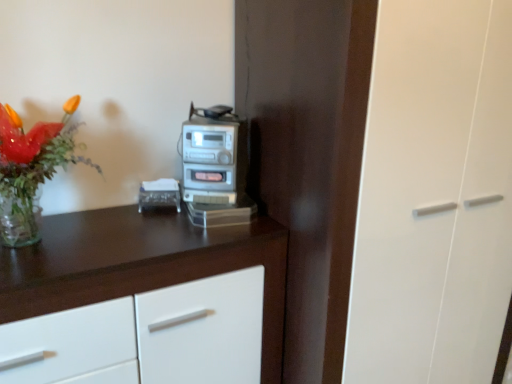
Question: Is white glossy cabinet at upper left surrounding silver metallic stereo at center?

Choices:
 (A) no
 (B) yes

Answer: (A)

Question: From a real-world perspective, does white glossy cabinet at upper left stand above silver metallic stereo at center?

Choices:
 (A) no
 (B) yes

Answer: (A)

Question: Does white glossy cabinet at upper left have a greater width compared to silver metallic stereo at center?

Choices:
 (A) no
 (B) yes

Answer: (B)

Question: Are white glossy cabinet at upper left and silver metallic stereo at center beside each other?

Choices:
 (A) yes
 (B) no

Answer: (B)

Question: Is the position of white glossy cabinet at upper left less distant than that of silver metallic stereo at center?

Choices:
 (A) yes
 (B) no

Answer: (A)

Question: Can you confirm if white glossy cabinet at upper left is smaller than silver metallic stereo at center?

Choices:
 (A) no
 (B) yes

Answer: (A)

Question: From the image's perspective, is clear plastic tissue box at center above translucent glass vase at upper left?

Choices:
 (A) yes
 (B) no

Answer: (B)

Question: Are clear plastic tissue box at center and translucent glass vase at upper left beside each other?

Choices:
 (A) yes
 (B) no

Answer: (B)

Question: Considering the relative positions of clear plastic tissue box at center and translucent glass vase at upper left in the image provided, is clear plastic tissue box at center behind translucent glass vase at upper left?

Choices:
 (A) no
 (B) yes

Answer: (B)

Question: Considering the relative sizes of clear plastic tissue box at center and translucent glass vase at upper left in the image provided, is clear plastic tissue box at center thinner than translucent glass vase at upper left?

Choices:
 (A) yes
 (B) no

Answer: (A)

Question: From the image's perspective, is clear plastic tissue box at center below translucent glass vase at upper left?

Choices:
 (A) yes
 (B) no

Answer: (A)

Question: Is clear plastic tissue box at center not within translucent glass vase at upper left?

Choices:
 (A) yes
 (B) no

Answer: (A)

Question: Is white glossy cabinet at upper left closer to the viewer compared to clear plastic tissue box at center?

Choices:
 (A) yes
 (B) no

Answer: (A)